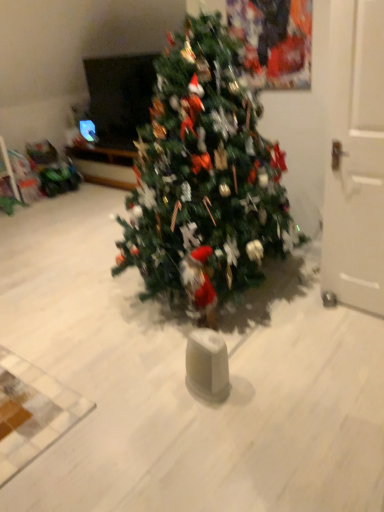
This screenshot has width=384, height=512. I want to click on free point below white matte door at right (from a real-world perspective), so (x=341, y=305).